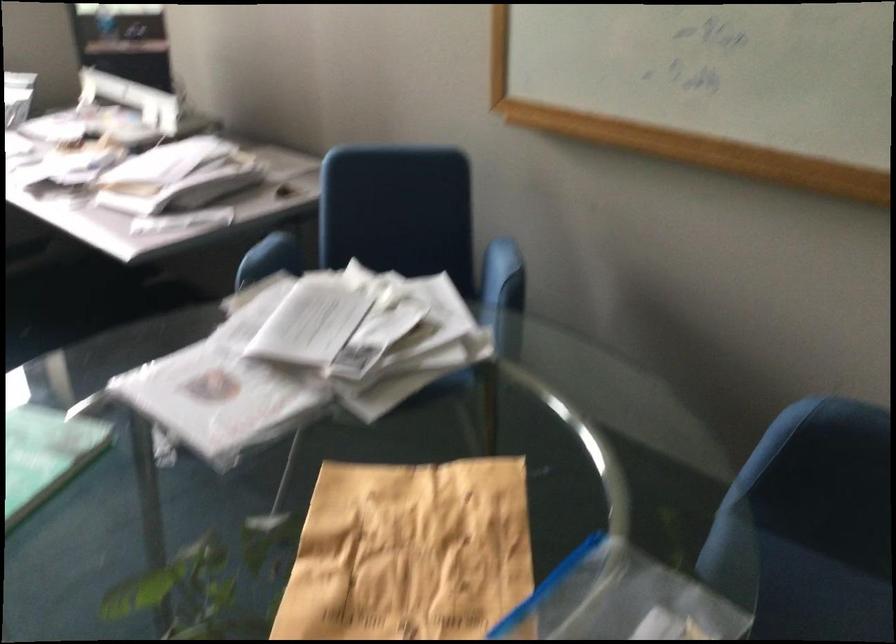
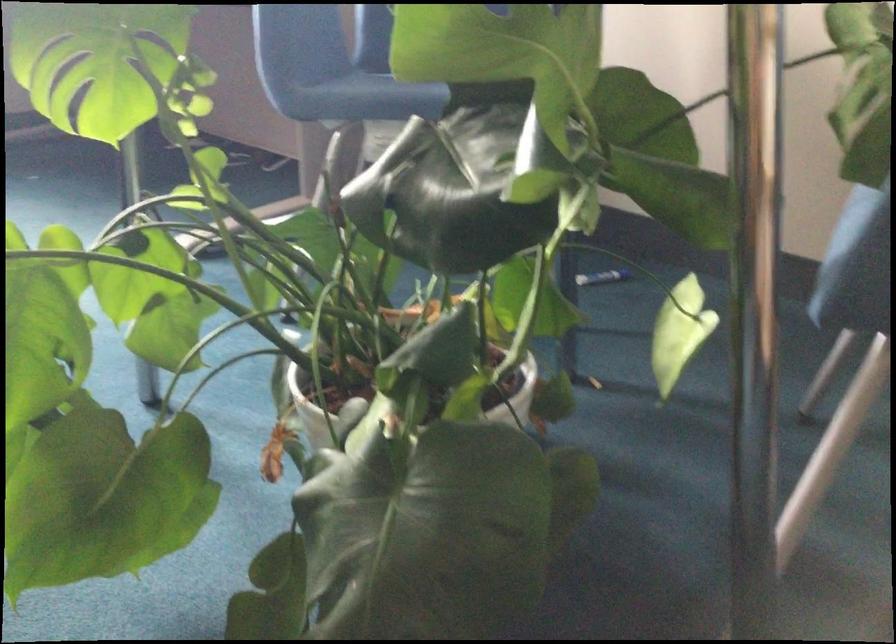
Question: The images are taken continuously from a first-person perspective. In which direction are you moving?

Choices:
 (A) Left
 (B) Right
 (C) Forward
 (D) Backward

Answer: (C)